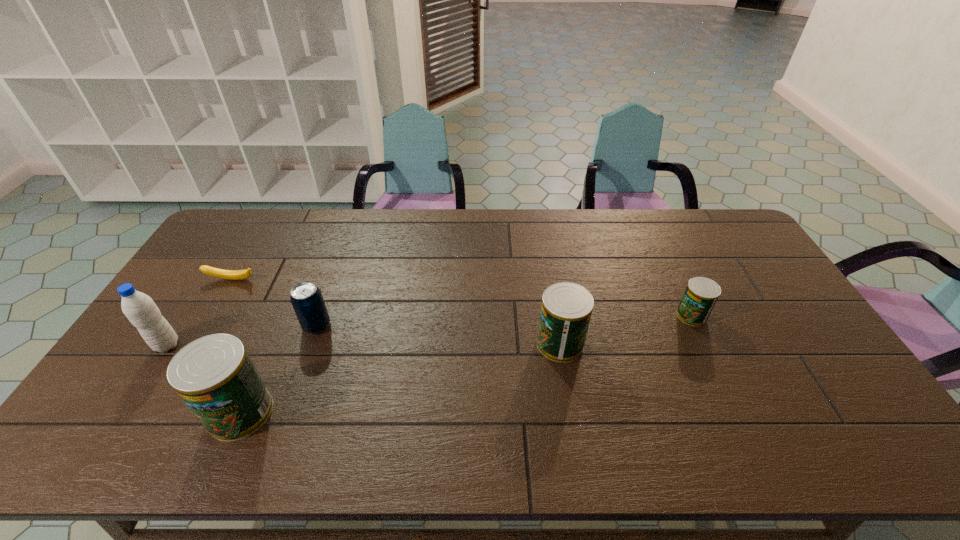
Locate an element on the screen. This screenshot has width=960, height=540. vacant space situated on the left of the nearest can is located at coordinates (121, 412).

In order to click on vacant space located 0.190m on the left of the second object from right to left in this screenshot , I will do `click(469, 344)`.

Locate an element on the screen. This screenshot has height=540, width=960. vacant area situated 0.100m on the back of the rightmost can is located at coordinates (676, 282).

What are the coordinates of `vacant point located 0.340m at the stem of the shortest object` in the screenshot? It's located at (178, 372).

At what (x,y) coordinates should I click in order to perform the action: click on vacant position located 0.120m on the front of the water bottle. Please return your answer as a coordinate pair (x, y). The height and width of the screenshot is (540, 960). Looking at the image, I should click on (136, 393).

This screenshot has width=960, height=540. In order to click on vacant space situated on the back of the third shortest object in this screenshot , I will do `click(325, 301)`.

In order to click on object present at the near edge in this screenshot , I will do pos(214,375).

This screenshot has height=540, width=960. What are the coordinates of `banana that is at the left edge` in the screenshot? It's located at (215, 272).

Locate an element on the screen. water bottle that is at the left edge is located at coordinates point(139,308).

Where is `free space at the far edge of the desktop`? The height and width of the screenshot is (540, 960). free space at the far edge of the desktop is located at coordinates (413, 225).